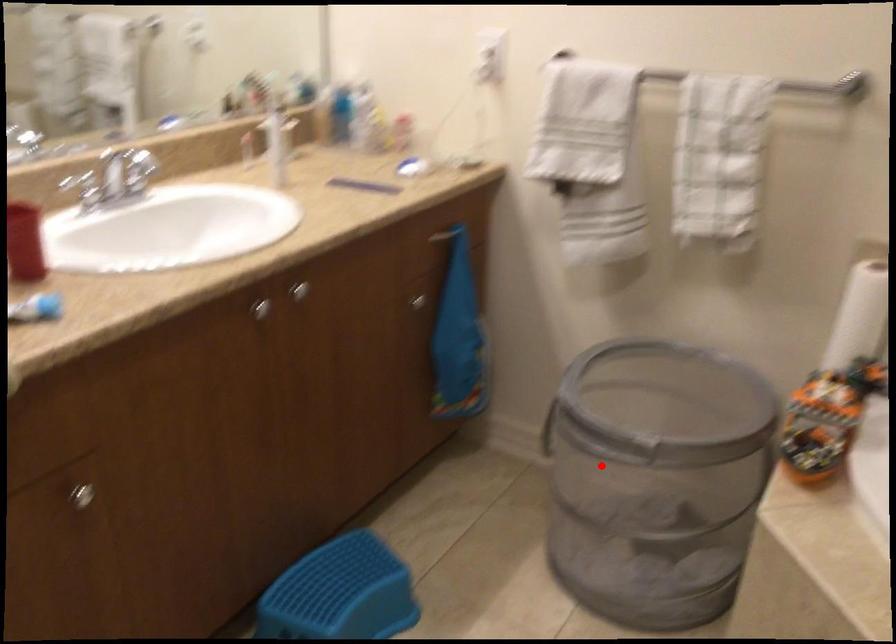
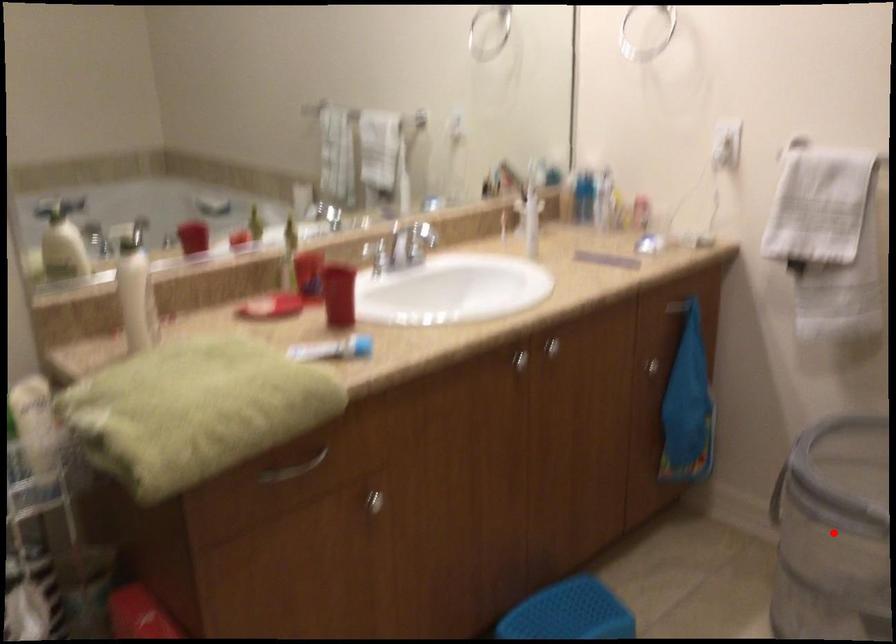
I am providing you with two images of the same scene from different viewpoints. A red point is marked on the first image and another point is marked on the second image. Is the marked point in image1 the same physical position as the marked point in image2?

Yes